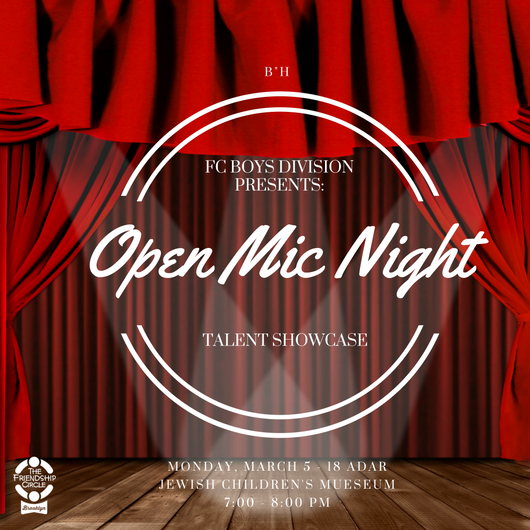
At what (x,y) coordinates should I click in order to perform the action: click on stage rear curtain. Please return your answer as a coordinate pair (x, y). The width and height of the screenshot is (530, 530). Looking at the image, I should click on (459, 370).